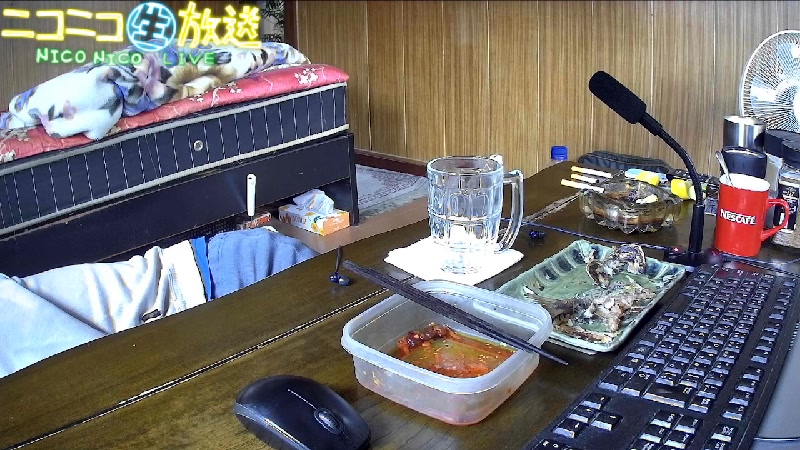
I want to click on chopstick, so click(x=442, y=308).